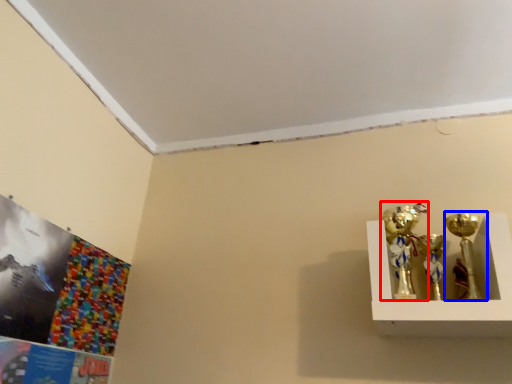
Question: Which of the following is the farthest to the observer, candle holder (highlighted by a red box) or candle holder (highlighted by a blue box)?

Choices:
 (A) candle holder
 (B) candle holder

Answer: (A)